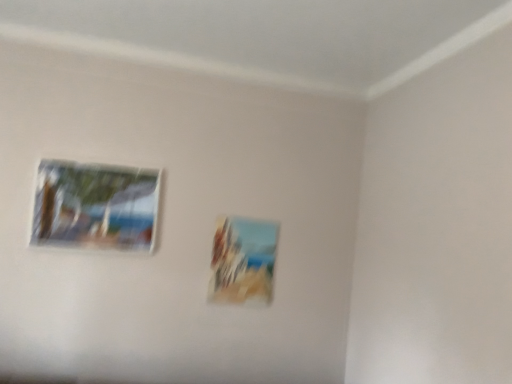
This screenshot has height=384, width=512. What do you see at coordinates (243, 261) in the screenshot? I see `matte wooden picture frame at center, which appears as the 1th picture frame when viewed from the back` at bounding box center [243, 261].

Locate an element on the screen. This screenshot has height=384, width=512. matte wooden picture frame at center, the 1th picture frame positioned from the right is located at coordinates (243, 261).

At what (x,y) coordinates should I click in order to perform the action: click on matte glass picture frame at upper left, marked as the second picture frame in a back-to-front arrangement. Please return your answer as a coordinate pair (x, y). Looking at the image, I should click on (95, 206).

Describe the element at coordinates (95, 206) in the screenshot. Image resolution: width=512 pixels, height=384 pixels. I see `matte glass picture frame at upper left, marked as the 1th picture frame in a front-to-back arrangement` at that location.

Where is `matte wooden picture frame at center, which appears as the 1th picture frame when viewed from the back`? The image size is (512, 384). matte wooden picture frame at center, which appears as the 1th picture frame when viewed from the back is located at coordinates (243, 261).

Considering the positions of objects matte wooden picture frame at center, acting as the 2th picture frame starting from the front, and matte glass picture frame at upper left, marked as the second picture frame in a back-to-front arrangement, in the image provided, who is more to the right, matte wooden picture frame at center, acting as the 2th picture frame starting from the front, or matte glass picture frame at upper left, marked as the second picture frame in a back-to-front arrangement,?

Positioned to the right is matte wooden picture frame at center, acting as the 2th picture frame starting from the front.

Is the position of matte wooden picture frame at center, arranged as the 2th picture frame when viewed from the left, less distant than that of matte glass picture frame at upper left, marked as the second picture frame in a back-to-front arrangement?

No, it is behind matte glass picture frame at upper left, marked as the second picture frame in a back-to-front arrangement.

Between point (216, 240) and point (69, 219), which one is positioned behind?

The point (216, 240) is farther from the camera.

From the image's perspective, which one is positioned higher, matte wooden picture frame at center, acting as the 2th picture frame starting from the front, or matte glass picture frame at upper left, marked as the 1th picture frame in a left-to-right arrangement?

From the image's view, matte glass picture frame at upper left, marked as the 1th picture frame in a left-to-right arrangement, is above.

From a real-world perspective, between matte wooden picture frame at center, acting as the 2th picture frame starting from the front, and matte glass picture frame at upper left, marked as the 1th picture frame in a left-to-right arrangement, who is vertically lower?

In real-world perspective, matte wooden picture frame at center, acting as the 2th picture frame starting from the front, is lower.

Which object is wider, matte wooden picture frame at center, acting as the 2th picture frame starting from the front, or matte glass picture frame at upper left, marked as the second picture frame in a back-to-front arrangement?

With larger width is matte glass picture frame at upper left, marked as the second picture frame in a back-to-front arrangement.

In the scene shown: Which of these two, matte wooden picture frame at center, which appears as the 1th picture frame when viewed from the back, or matte glass picture frame at upper left, marked as the 1th picture frame in a front-to-back arrangement, stands taller?

matte wooden picture frame at center, which appears as the 1th picture frame when viewed from the back, is taller.

Considering the sizes of objects matte wooden picture frame at center, the 1th picture frame positioned from the right, and matte glass picture frame at upper left, marked as the 1th picture frame in a left-to-right arrangement, in the image provided, who is bigger, matte wooden picture frame at center, the 1th picture frame positioned from the right, or matte glass picture frame at upper left, marked as the 1th picture frame in a left-to-right arrangement,?

Bigger between the two is matte glass picture frame at upper left, marked as the 1th picture frame in a left-to-right arrangement.

Choose the correct answer: Is matte wooden picture frame at center, the 1th picture frame positioned from the right, inside matte glass picture frame at upper left, marked as the 1th picture frame in a front-to-back arrangement, or outside it?

matte wooden picture frame at center, the 1th picture frame positioned from the right, is spatially situated outside matte glass picture frame at upper left, marked as the 1th picture frame in a front-to-back arrangement.

Is matte wooden picture frame at center, the 1th picture frame positioned from the right, placed right next to matte glass picture frame at upper left, marked as the 1th picture frame in a left-to-right arrangement?

matte wooden picture frame at center, the 1th picture frame positioned from the right, is not next to matte glass picture frame at upper left, marked as the 1th picture frame in a left-to-right arrangement, and they're not touching.

Is matte wooden picture frame at center, the 1th picture frame positioned from the right, oriented away from matte glass picture frame at upper left, marked as the second picture frame in a back-to-front arrangement?

No, matte wooden picture frame at center, the 1th picture frame positioned from the right,'s orientation is not away from matte glass picture frame at upper left, marked as the second picture frame in a back-to-front arrangement.

What's the angular difference between matte wooden picture frame at center, the 1th picture frame positioned from the right, and matte glass picture frame at upper left, positioned as the 2th picture frame in right-to-left order,'s facing directions?

The angle between the facing direction of matte wooden picture frame at center, the 1th picture frame positioned from the right, and the facing direction of matte glass picture frame at upper left, positioned as the 2th picture frame in right-to-left order, is 0.00251 degrees.

You are a GUI agent. You are given a task and a screenshot of the screen. Output one action in this format:
    pyautogui.click(x=<x>, y=<y>)
    Task: Click on the picture frame below the matte glass picture frame at upper left, positioned as the 2th picture frame in right-to-left order (from the image's perspective)
    
    Given the screenshot: What is the action you would take?
    tap(243, 261)

Is matte glass picture frame at upper left, marked as the 1th picture frame in a front-to-back arrangement, to the right of matte wooden picture frame at center, the 1th picture frame positioned from the right, from the viewer's perspective?

Incorrect, matte glass picture frame at upper left, marked as the 1th picture frame in a front-to-back arrangement, is not on the right side of matte wooden picture frame at center, the 1th picture frame positioned from the right.

Is the position of matte glass picture frame at upper left, marked as the 1th picture frame in a left-to-right arrangement, more distant than that of matte wooden picture frame at center, acting as the 2th picture frame starting from the front?

No, matte glass picture frame at upper left, marked as the 1th picture frame in a left-to-right arrangement, is closer to the camera.

Which is behind, point (116, 176) or point (234, 251)?

The point (234, 251) is more distant.

In the scene shown: From the image's perspective, does matte glass picture frame at upper left, marked as the second picture frame in a back-to-front arrangement, appear lower than matte wooden picture frame at center, the 1th picture frame positioned from the right?

Incorrect, from the image's perspective, matte glass picture frame at upper left, marked as the second picture frame in a back-to-front arrangement, is higher than matte wooden picture frame at center, the 1th picture frame positioned from the right.

From a real-world perspective, is matte glass picture frame at upper left, marked as the 1th picture frame in a front-to-back arrangement, located higher than matte wooden picture frame at center, acting as the 2th picture frame starting from the front?

Indeed, from a real-world perspective, matte glass picture frame at upper left, marked as the 1th picture frame in a front-to-back arrangement, stands above matte wooden picture frame at center, acting as the 2th picture frame starting from the front.

Can you confirm if matte glass picture frame at upper left, marked as the second picture frame in a back-to-front arrangement, is wider than matte wooden picture frame at center, which appears as the 1th picture frame when viewed from the back?

Yes.

Does matte glass picture frame at upper left, marked as the 1th picture frame in a front-to-back arrangement, have a greater height compared to matte wooden picture frame at center, arranged as the 2th picture frame when viewed from the left?

No.

Considering the sizes of objects matte glass picture frame at upper left, positioned as the 2th picture frame in right-to-left order, and matte wooden picture frame at center, arranged as the 2th picture frame when viewed from the left, in the image provided, who is bigger, matte glass picture frame at upper left, positioned as the 2th picture frame in right-to-left order, or matte wooden picture frame at center, arranged as the 2th picture frame when viewed from the left,?

matte glass picture frame at upper left, positioned as the 2th picture frame in right-to-left order.

Is matte glass picture frame at upper left, positioned as the 2th picture frame in right-to-left order, not inside matte wooden picture frame at center, arranged as the 2th picture frame when viewed from the left?

Yes.

Looking at this image, are matte glass picture frame at upper left, positioned as the 2th picture frame in right-to-left order, and matte wooden picture frame at center, acting as the 2th picture frame starting from the front, located far from each other?

No.

Could you tell me if matte glass picture frame at upper left, positioned as the 2th picture frame in right-to-left order, is facing matte wooden picture frame at center, the 1th picture frame positioned from the right?

No, matte glass picture frame at upper left, positioned as the 2th picture frame in right-to-left order, is not turned towards matte wooden picture frame at center, the 1th picture frame positioned from the right.

What's the angular difference between matte glass picture frame at upper left, positioned as the 2th picture frame in right-to-left order, and matte wooden picture frame at center, which appears as the 1th picture frame when viewed from the back,'s facing directions?

matte glass picture frame at upper left, positioned as the 2th picture frame in right-to-left order, and matte wooden picture frame at center, which appears as the 1th picture frame when viewed from the back, are facing 0.00251 degrees away from each other.

How much distance is there between matte glass picture frame at upper left, marked as the 1th picture frame in a front-to-back arrangement, and matte wooden picture frame at center, the 1th picture frame positioned from the right?

A distance of 27.40 inches exists between matte glass picture frame at upper left, marked as the 1th picture frame in a front-to-back arrangement, and matte wooden picture frame at center, the 1th picture frame positioned from the right.

I want to click on picture frame below the matte glass picture frame at upper left, marked as the 1th picture frame in a left-to-right arrangement (from a real-world perspective), so click(243, 261).

What are the coordinates of `picture frame beneath the matte glass picture frame at upper left, positioned as the 2th picture frame in right-to-left order (from a real-world perspective)` in the screenshot? It's located at (243, 261).

Where is `picture frame located on the left of matte wooden picture frame at center, arranged as the 2th picture frame when viewed from the left`? This screenshot has height=384, width=512. picture frame located on the left of matte wooden picture frame at center, arranged as the 2th picture frame when viewed from the left is located at coordinates (95, 206).